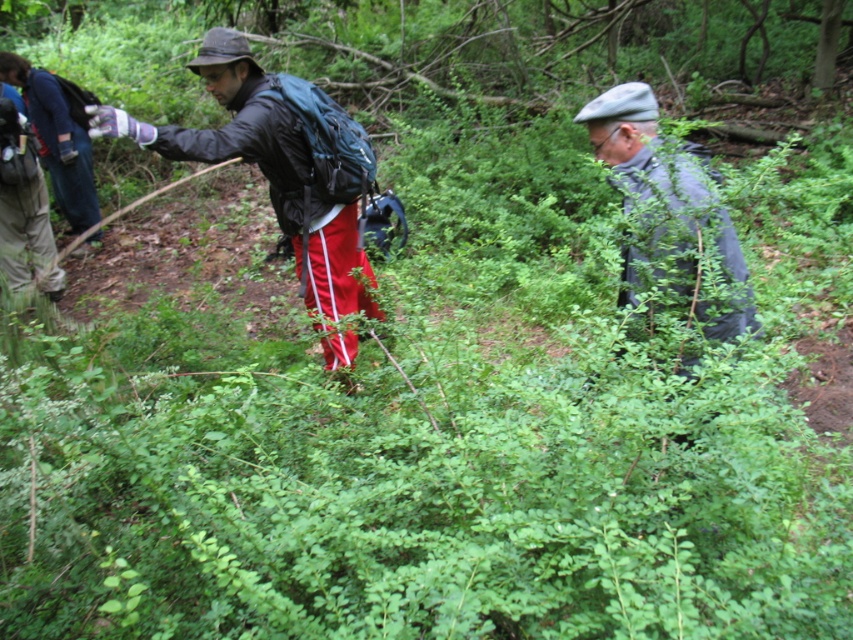
Can you confirm if matte black jacket at center is positioned below gray fabric jacket at center?

No, matte black jacket at center is not below gray fabric jacket at center.

Does point (264, 90) come behind point (734, 300)?

Yes.

This screenshot has height=640, width=853. What are the coordinates of `matte black jacket at center` in the screenshot? It's located at (276, 164).